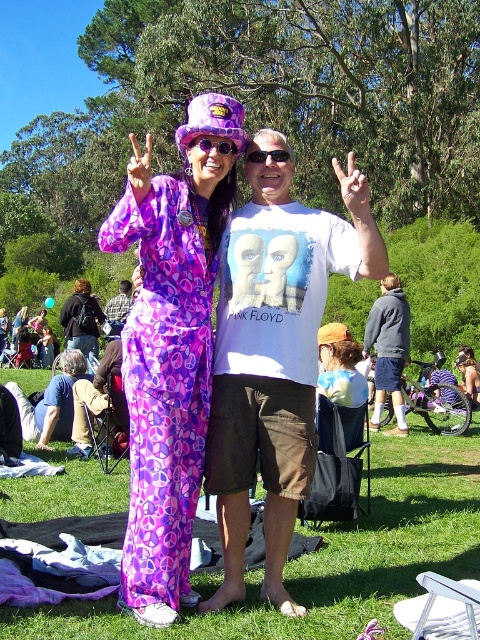
Question: Which point is farther to the camera?

Choices:
 (A) click(x=253, y=253)
 (B) click(x=319, y=605)

Answer: (A)

Question: Which object is the farthest from the purple floral dress at center?

Choices:
 (A) black plastic sunglasses at center
 (B) light brown leather jacket at lower left
 (C) green grass at center
 (D) white cotton t-shirt at center

Answer: (B)

Question: Is purple fabric blanket at lower center positioned in front of black plastic sunglasses at center?

Choices:
 (A) yes
 (B) no

Answer: (A)

Question: Estimate the real-world distances between objects in this image. Which object is farther from the white cotton t-shirt at center?

Choices:
 (A) dark gray hoodie at center
 (B) matte purple jumpsuit at center

Answer: (B)

Question: Is purple fabric blanket at lower center positioned behind purple fabric goggles at center?

Choices:
 (A) yes
 (B) no

Answer: (B)

Question: Can you confirm if white cotton t-shirt at center is positioned below purple floral dress at center?

Choices:
 (A) no
 (B) yes

Answer: (A)